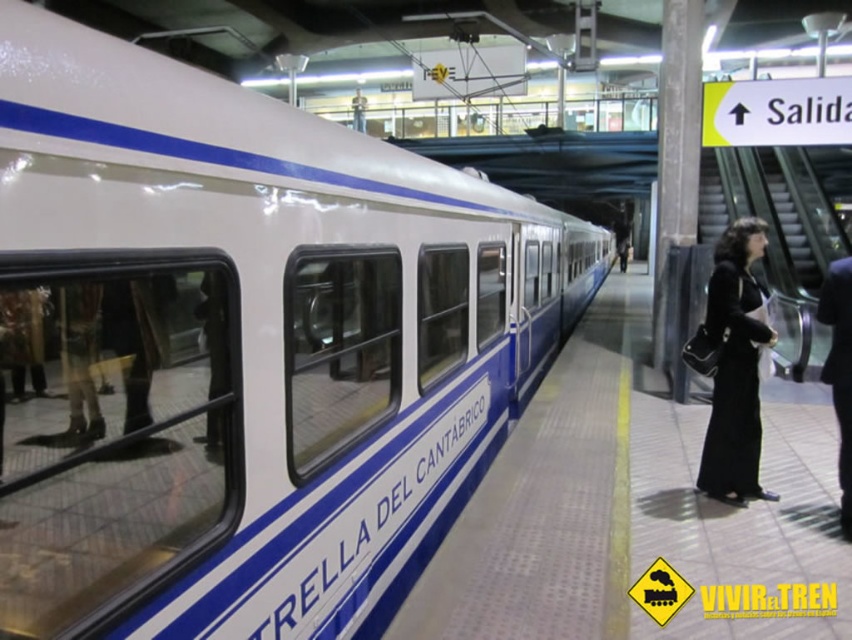
Question: In this image, where is white glossy train at left located relative to black fabric coat at right?

Choices:
 (A) left
 (B) right

Answer: (A)

Question: Which object is positioned closest to the black fabric coat at right?

Choices:
 (A) white glossy train at left
 (B) black matte coat at right

Answer: (B)

Question: Which of the following is the farthest from the observer?

Choices:
 (A) black matte coat at right
 (B) black fabric coat at right
 (C) white glossy train at left

Answer: (A)

Question: Is black matte coat at right smaller than black fabric coat at right?

Choices:
 (A) yes
 (B) no

Answer: (B)

Question: Is white glossy train at left below black matte coat at right?

Choices:
 (A) no
 (B) yes

Answer: (A)

Question: Among these points, which one is nearest to the camera?

Choices:
 (A) (730, 468)
 (B) (841, 484)

Answer: (B)